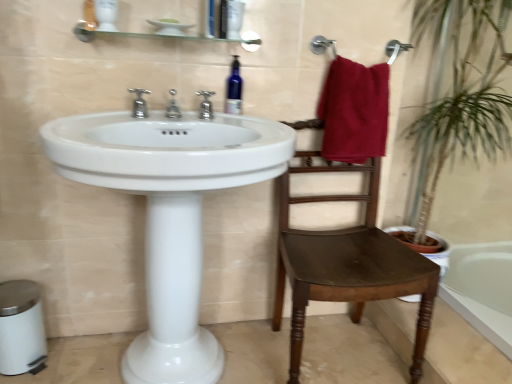
Question: Is maroon fabric towel at upper right bigger than white glossy sink at center?

Choices:
 (A) no
 (B) yes

Answer: (A)

Question: Is maroon fabric towel at upper right at the right side of white glossy sink at center?

Choices:
 (A) yes
 (B) no

Answer: (A)

Question: Is maroon fabric towel at upper right oriented away from white glossy sink at center?

Choices:
 (A) yes
 (B) no

Answer: (B)

Question: Considering the relative sizes of maroon fabric towel at upper right and white glossy sink at center in the image provided, is maroon fabric towel at upper right wider than white glossy sink at center?

Choices:
 (A) yes
 (B) no

Answer: (B)

Question: Could you tell me if maroon fabric towel at upper right is facing white glossy sink at center?

Choices:
 (A) yes
 (B) no

Answer: (B)

Question: From their relative heights in the image, would you say polished chrome faucet at center, the 1th tap in the right-to-left sequence, is taller or shorter than blue glass bottle at upper center?

Choices:
 (A) short
 (B) tall

Answer: (A)

Question: In the image, is polished chrome faucet at center, the third tap positioned from the left, on the left side or the right side of blue glass bottle at upper center?

Choices:
 (A) right
 (B) left

Answer: (B)

Question: In terms of width, does polished chrome faucet at center, the third tap positioned from the left, look wider or thinner when compared to blue glass bottle at upper center?

Choices:
 (A) wide
 (B) thin

Answer: (A)

Question: Is point (199, 94) positioned closer to the camera than point (234, 107)?

Choices:
 (A) farther
 (B) closer

Answer: (B)

Question: In the image, is polished chrome faucet at center, the third tap positioned from the left, positioned in front of or behind maroon fabric towel at upper right?

Choices:
 (A) front
 (B) behind

Answer: (A)

Question: Looking at their shapes, would you say polished chrome faucet at center, the 1th tap in the right-to-left sequence, is wider or thinner than maroon fabric towel at upper right?

Choices:
 (A) wide
 (B) thin

Answer: (B)

Question: Does point (204, 110) appear closer or farther from the camera than point (351, 129)?

Choices:
 (A) farther
 (B) closer

Answer: (A)

Question: Is polished chrome faucet at center, the 1th tap in the right-to-left sequence, inside or outside of maroon fabric towel at upper right?

Choices:
 (A) outside
 (B) inside

Answer: (A)

Question: Considering the positions of point (247, 170) and point (214, 92), is point (247, 170) closer or farther from the camera than point (214, 92)?

Choices:
 (A) farther
 (B) closer

Answer: (B)

Question: Looking at their shapes, would you say white glossy sink at center is wider or thinner than polished chrome faucet at center, the third tap positioned from the left?

Choices:
 (A) wide
 (B) thin

Answer: (A)